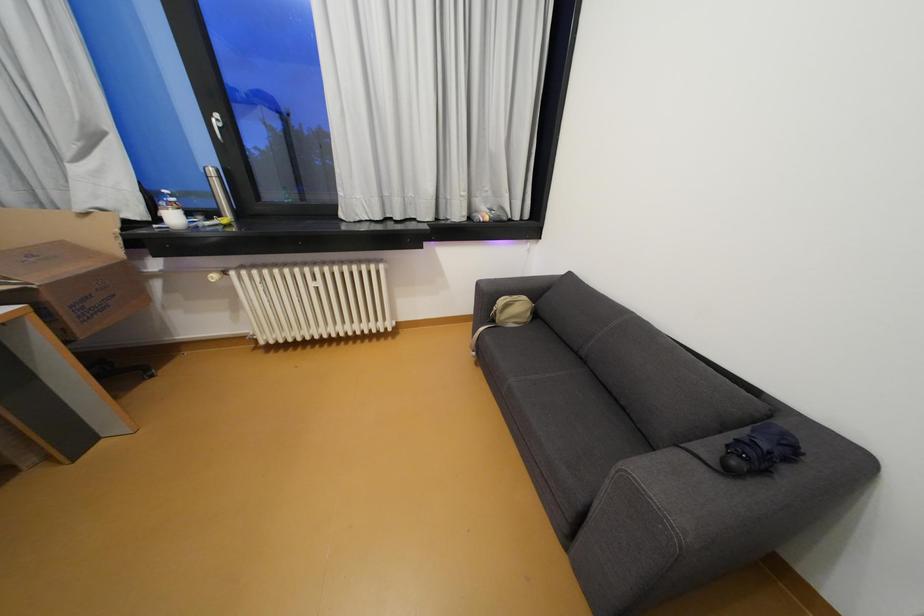
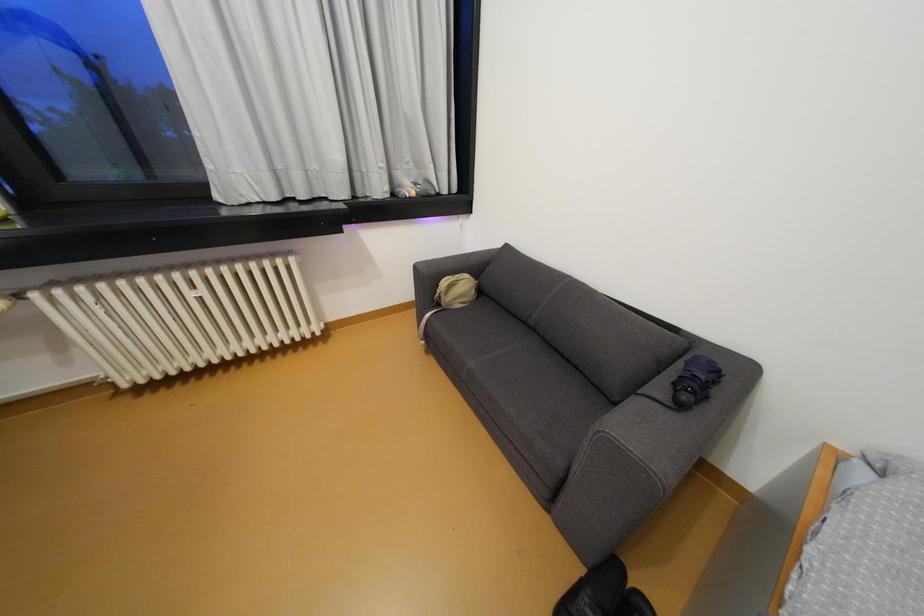
Question: What movement of the cameraman would produce the second image?

Choices:
 (A) Left
 (B) Right
 (C) Forward
 (D) Backward

Answer: (C)